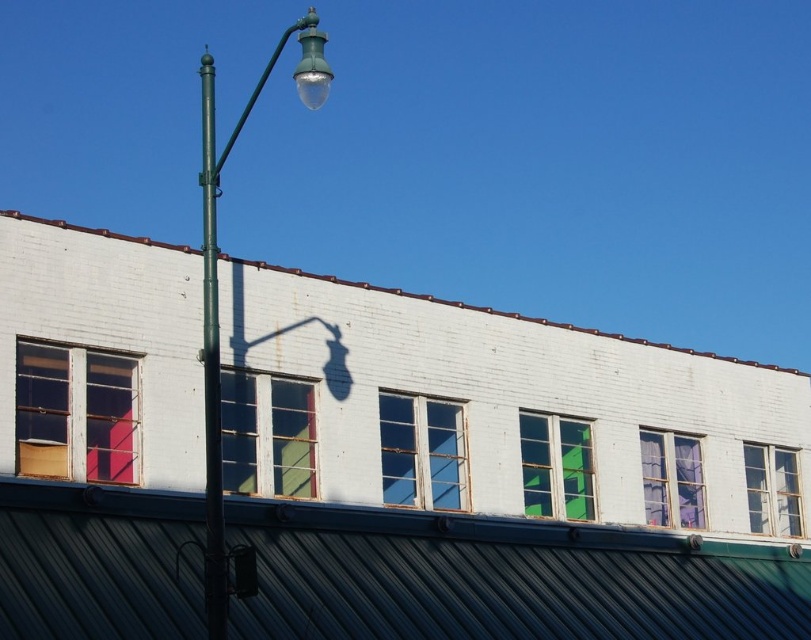
You are a delivery person trying to park your 1.2 meter wide delivery van between the green metallic pole at left and the purple sheer curtains at upper right. Based on the scene, can you safely park there without hitting either object?

The green metallic pole at left might be wider than purple sheer curtains at upper right, so it is uncertain if the van can fit. Check the actual width before parking.

You are a window installer assessing the building. You need to replace the green matte street light at upper left and the purple sheer curtains at upper right. Which object requires a larger replacement part?

The green matte street light at upper left requires a larger replacement part because it is larger in size than the purple sheer curtains at upper right according to the description.

You are standing in front of the building and notice the clear glass window at center and the purple sheer curtains at upper right. Which object is positioned to the right side of the other?

The purple sheer curtains at upper right are to the right of the clear glass window at center.